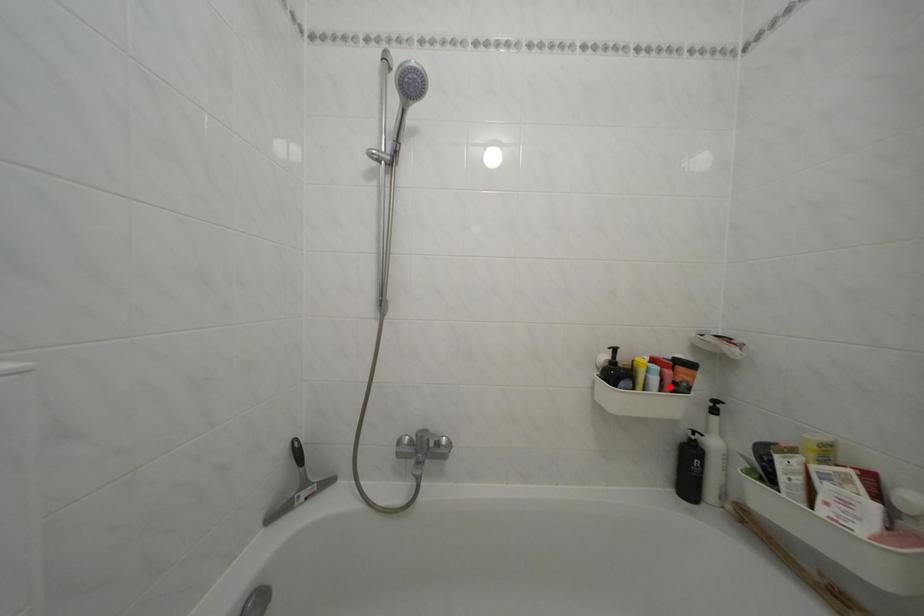
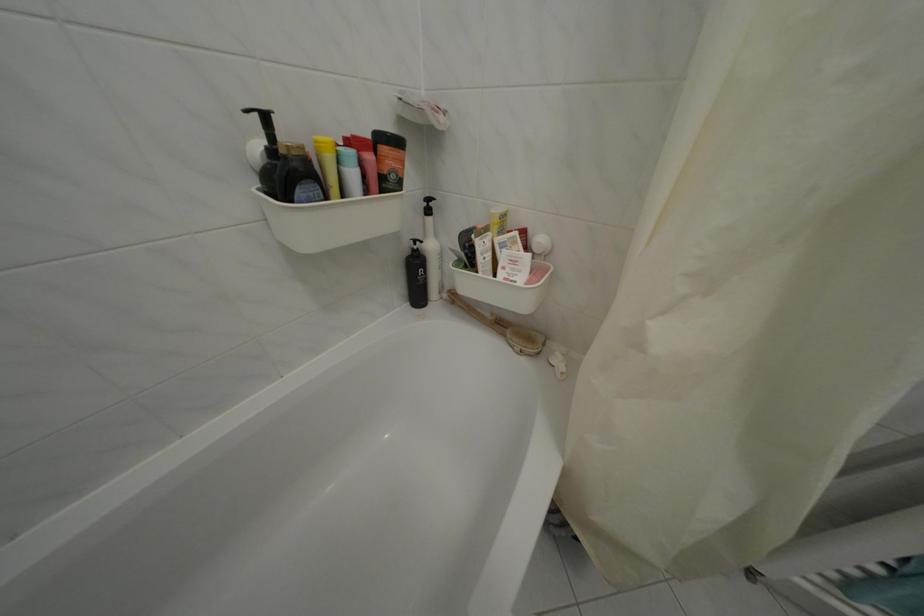
The point at the highlighted location is marked in the first image. Where is the corresponding point in the second image?

(372, 182)